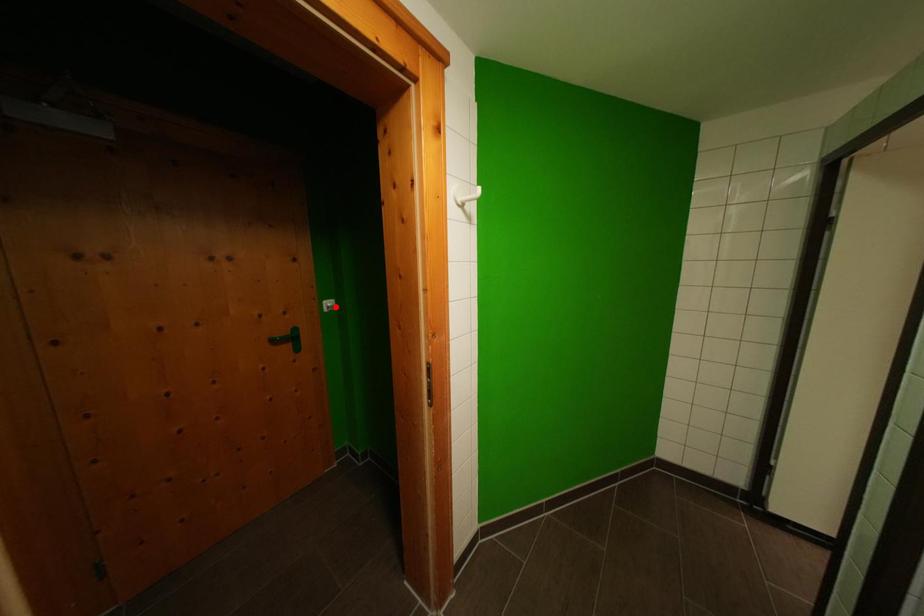
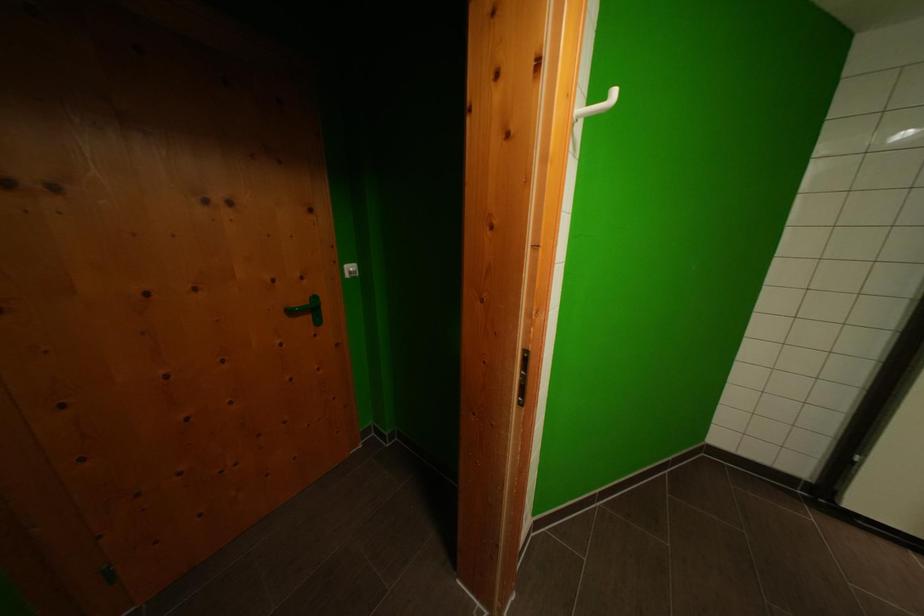
The point at the highlighted location is marked in the first image. Where is the corresponding point in the second image?

(358, 272)